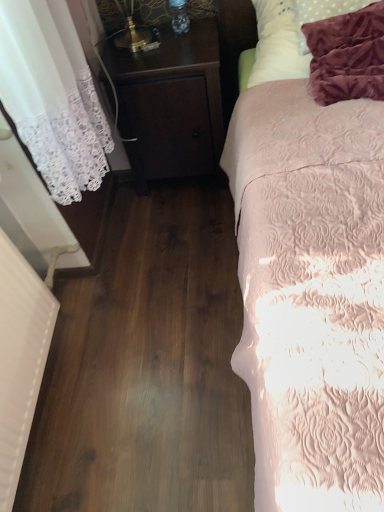
Where is `free space in front of dark wood nightstand at center`? The height and width of the screenshot is (512, 384). free space in front of dark wood nightstand at center is located at coordinates (180, 219).